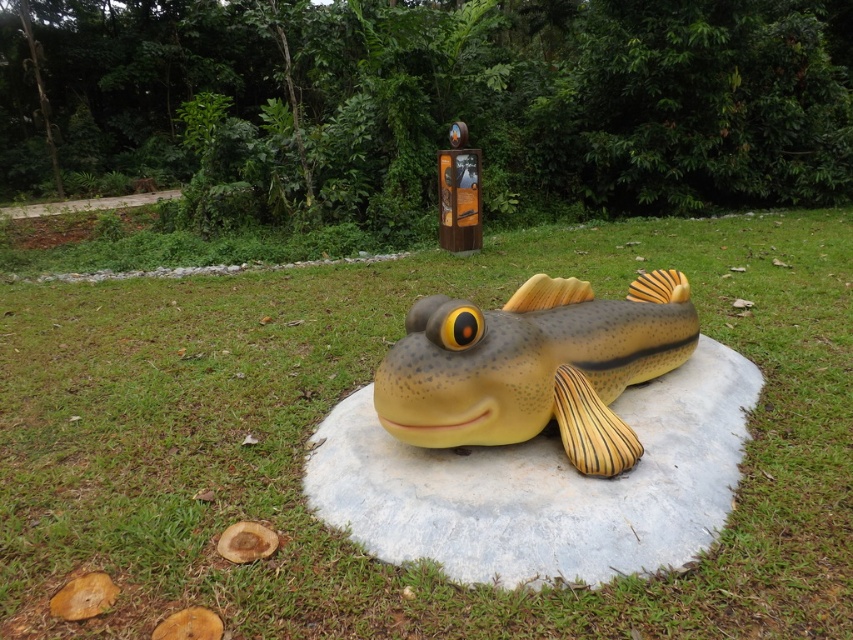
You are a gardener who wants to mow the lawn around the green grass at center and the matte yellow fish at center. Which area requires mowing first based on their height?

The green grass at center has a lesser height compared to matte yellow fish at center, so you should mow the green grass at center first since it is shorter and needs maintenance before it grows taller.